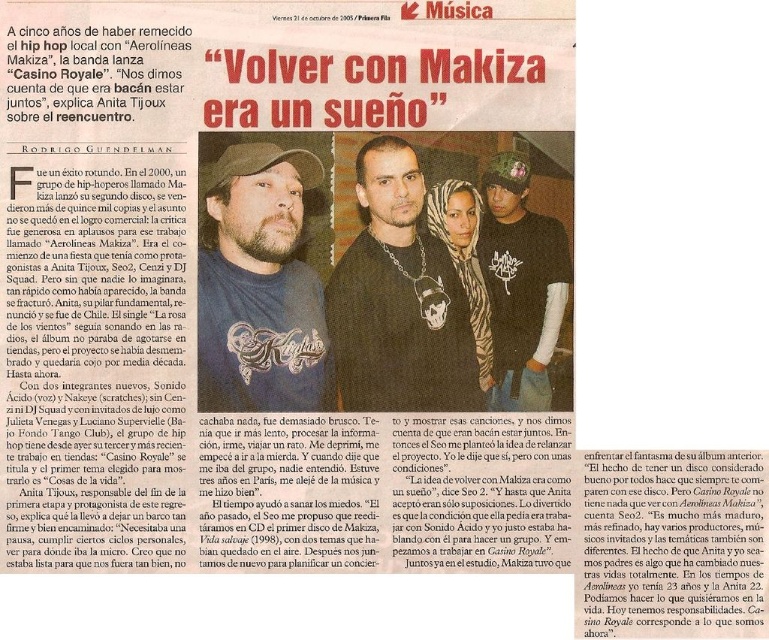
You are a photographer reviewing a scanned newspaper page. You notice two points marked on the image. The first point is at coordinate (375, 355) and the second is at (561, 284). Based on the spatial relationship between these points, which point appears closer to the top edge of the newspaper page?

Point (561, 284) is closer to the top edge of the newspaper page because it has a higher y coordinate value than point (375, 355).